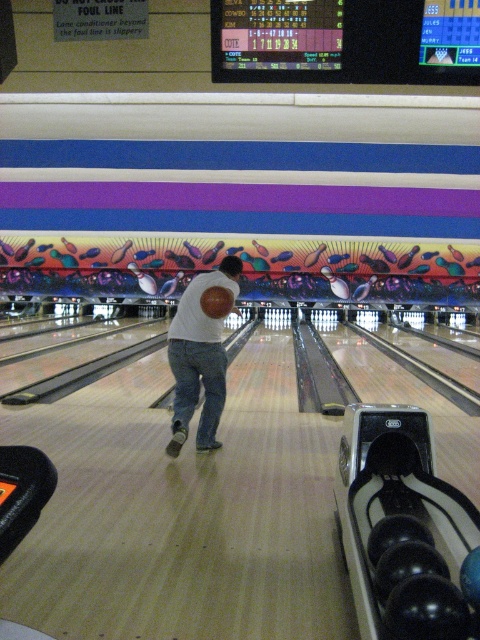
In order to click on white matte shirt at center in this screenshot , I will do `click(199, 358)`.

Is point (180, 390) closer to camera compared to point (217, 348)?

No.

Who is more distant from viewer, (x=216, y=269) or (x=178, y=397)?

Positioned behind is point (x=216, y=269).

Locate an element on the screen. white matte shirt at center is located at coordinates (199, 358).